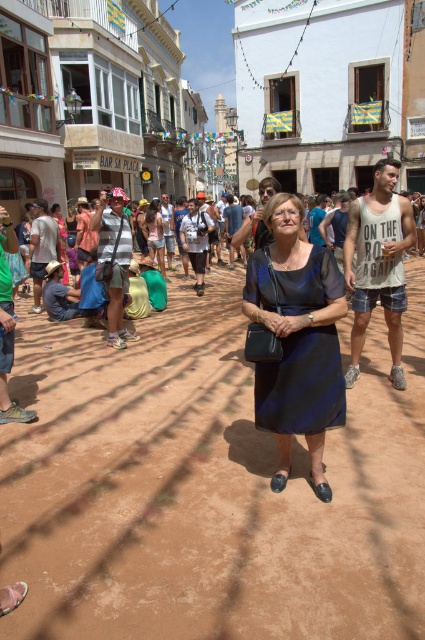
Who is lower down, navy satin dress at center or matte black dress at center?

Positioned lower is navy satin dress at center.

Does navy satin dress at center have a larger size compared to matte black dress at center?

Indeed, navy satin dress at center has a larger size compared to matte black dress at center.

Between point (255, 368) and point (150, 237), which one is positioned behind?

The point (150, 237) is more distant.

You are a GUI agent. You are given a task and a screenshot of the screen. Output one action in this format:
    pyautogui.click(x=<x>, y=<y>)
    Task: Click on the navy satin dress at center
    
    Given the screenshot: What is the action you would take?
    pyautogui.click(x=302, y=385)